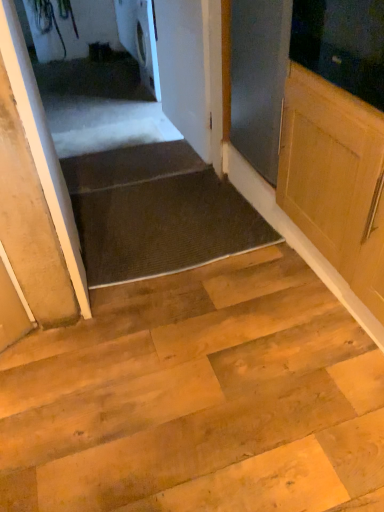
Question: Is white glossy washing machine at upper center completely or partially outside of dark brown carpet at lower center?

Choices:
 (A) no
 (B) yes

Answer: (B)

Question: Would you consider white glossy washing machine at upper center to be distant from dark brown carpet at lower center?

Choices:
 (A) no
 (B) yes

Answer: (B)

Question: From a real-world perspective, does white glossy washing machine at upper center stand above dark brown carpet at lower center?

Choices:
 (A) no
 (B) yes

Answer: (B)

Question: Is the depth of white glossy washing machine at upper center less than that of dark brown carpet at lower center?

Choices:
 (A) yes
 (B) no

Answer: (B)

Question: Can you confirm if white glossy washing machine at upper center is bigger than dark brown carpet at lower center?

Choices:
 (A) yes
 (B) no

Answer: (A)

Question: From a real-world perspective, is white glossy washing machine at upper center positioned under dark brown carpet at lower center based on gravity?

Choices:
 (A) no
 (B) yes

Answer: (A)

Question: From the image's perspective, is dark gray textured mat at center below white matte door at upper center, which is the first door in right-to-left order?

Choices:
 (A) no
 (B) yes

Answer: (B)

Question: Would you say dark gray textured mat at center contains white matte door at upper center, the first door positioned from the back?

Choices:
 (A) no
 (B) yes

Answer: (A)

Question: Can you confirm if dark gray textured mat at center is wider than white matte door at upper center, which is the first door in right-to-left order?

Choices:
 (A) no
 (B) yes

Answer: (B)

Question: Is dark gray textured mat at center taller than white matte door at upper center, the first door positioned from the back?

Choices:
 (A) no
 (B) yes

Answer: (A)

Question: Is dark gray textured mat at center in front of white matte door at upper center, the 2th door in the left-to-right sequence?

Choices:
 (A) yes
 (B) no

Answer: (A)

Question: From a real-world perspective, is dark gray textured mat at center below white matte door at upper center, the first door positioned from the back?

Choices:
 (A) no
 (B) yes

Answer: (B)

Question: Is dark gray textured mat at center positioned before white glossy washing machine at upper center?

Choices:
 (A) no
 (B) yes

Answer: (B)